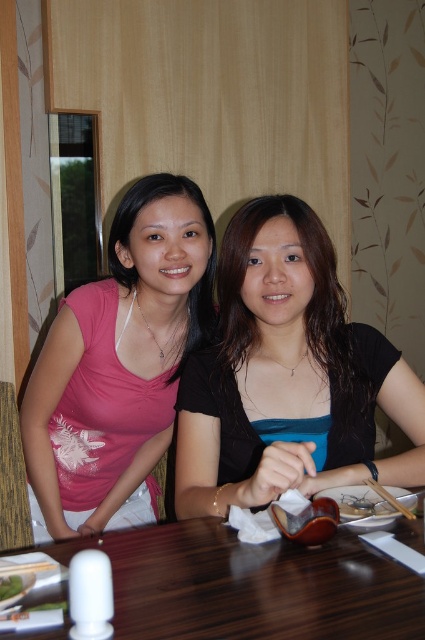
Question: Which point is farther to the camera?

Choices:
 (A) wooden chopsticks at table right
 (B) green leafy vegetable at lower left

Answer: (A)

Question: Does matte black shirt at center come behind green leafy vegetable at lower left?

Choices:
 (A) no
 (B) yes

Answer: (B)

Question: Among these points, which one is nearest to the camera?

Choices:
 (A) (382, 392)
 (B) (393, 499)
 (C) (8, 576)

Answer: (C)

Question: Can you confirm if matte black shirt at center is positioned to the right of wooden table at center?

Choices:
 (A) no
 (B) yes

Answer: (B)

Question: Can you confirm if wooden table at center is smaller than wooden chopsticks at table right?

Choices:
 (A) yes
 (B) no

Answer: (B)

Question: Estimate the real-world distances between objects in this image. Which object is farther from the wooden chopsticks at table right?

Choices:
 (A) matte pink shirt at left
 (B) green leafy vegetable at lower left
 (C) wooden table at center

Answer: (A)